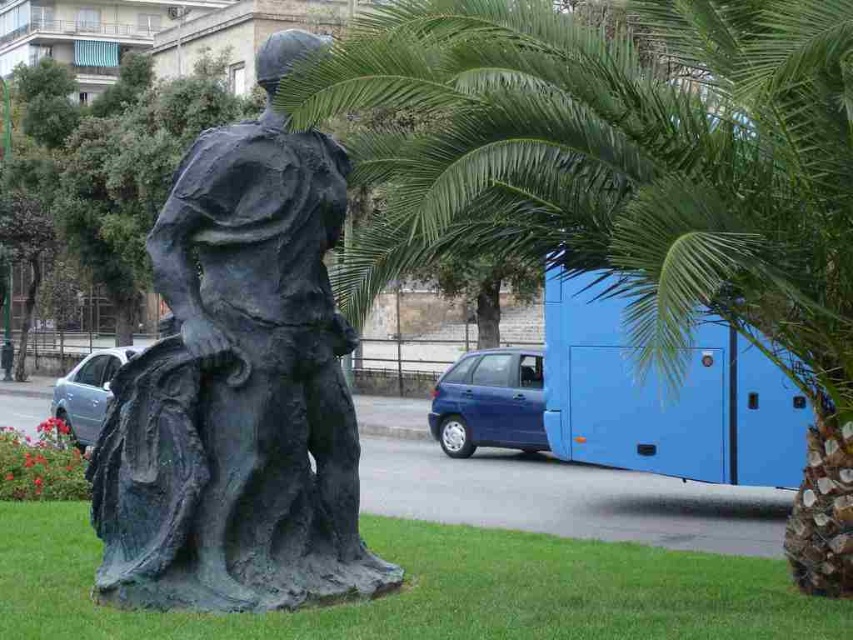
You are a photographer planning to capture a wide shot of the bronze statue at center and the green leafy palm tree at upper right. Based on their widths, which object will occupy more space in the photo?

The green leafy palm tree at upper right will occupy more space in the photo because its width surpasses that of the bronze statue at center.